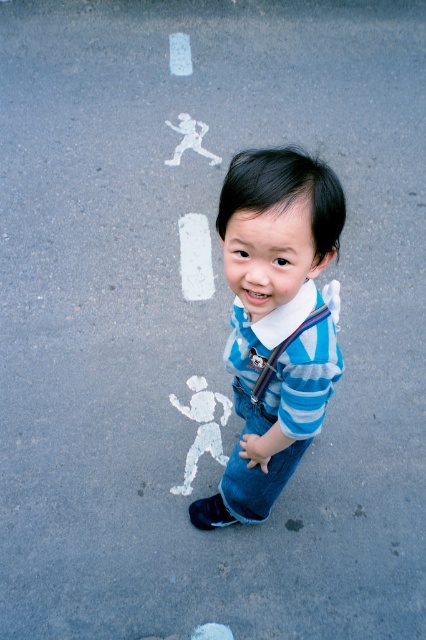
Does point (293, 333) come behind point (265, 381)?

No, it is in front of (265, 381).

Can you confirm if blue striped shirt at center is shorter than striped fabric suspenders at center?

Incorrect, blue striped shirt at center's height does not fall short of striped fabric suspenders at center's.

Does point (314, 173) come behind point (302, 323)?

No, (314, 173) is closer to viewer.

In order to click on blue striped shirt at center in this screenshot , I will do `click(275, 323)`.